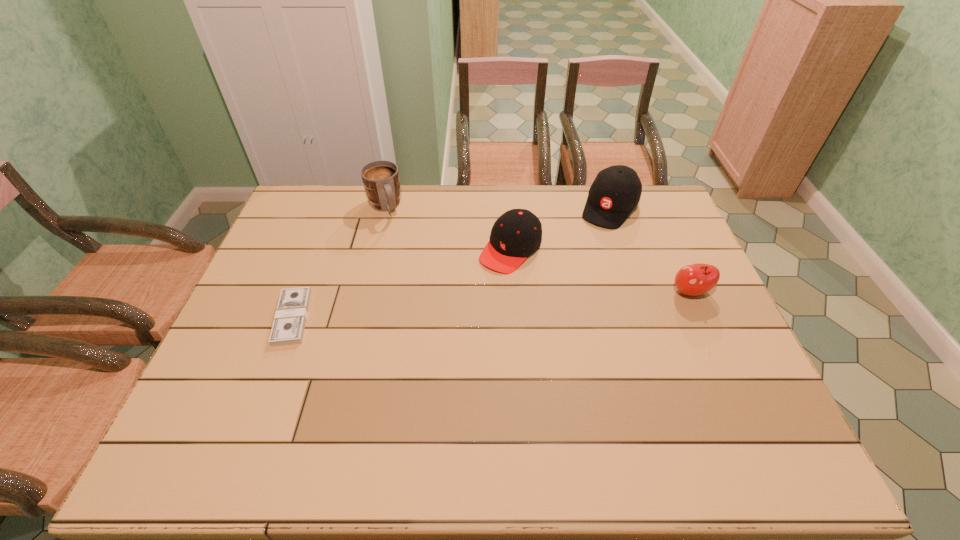
Locate an element on the screen. Image resolution: width=960 pixels, height=540 pixels. object situated at the left edge is located at coordinates (289, 322).

I want to click on apple present at the right edge, so click(696, 279).

This screenshot has width=960, height=540. In order to click on baseball cap situated at the right edge in this screenshot , I will do `click(616, 191)`.

Image resolution: width=960 pixels, height=540 pixels. I want to click on object positioned at the far right corner, so click(616, 191).

Locate an element on the screen. This screenshot has width=960, height=540. vacant space at the far edge of the desktop is located at coordinates (497, 200).

The width and height of the screenshot is (960, 540). Find the location of `vacant area at the near edge`. vacant area at the near edge is located at coordinates (363, 398).

In the image, there is a desktop. At what (x,y) coordinates should I click in order to perform the action: click on free region at the right edge. Please return your answer as a coordinate pair (x, y). The height and width of the screenshot is (540, 960). Looking at the image, I should click on (665, 321).

In the image, there is a desktop. Identify the location of vacant space at the far left corner. (325, 220).

Locate an element on the screen. This screenshot has width=960, height=540. free space between the second object from left to right and the baseball cap is located at coordinates (497, 207).

At what (x,y) coordinates should I click in order to perform the action: click on vacant space that's between the apple and the fourth object from right to left. Please return your answer as a coordinate pair (x, y). The image size is (960, 540). Looking at the image, I should click on (538, 249).